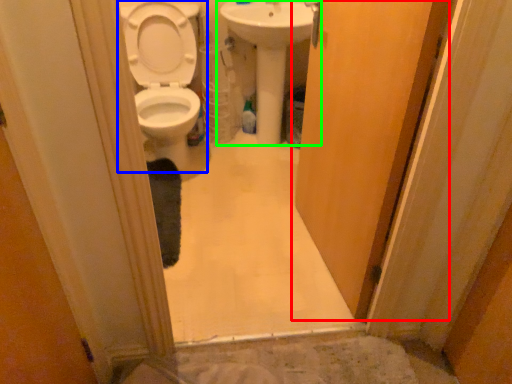
Question: Considering the real-world distances, which object is closest to door (highlighted by a red box)? toilet (highlighted by a blue box) or sink (highlighted by a green box).

Choices:
 (A) toilet
 (B) sink

Answer: (B)